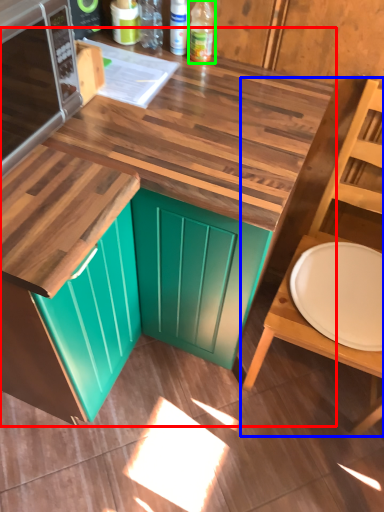
Question: Estimate the real-world distances between objects in this image. Which object is closer to countertop (highlighted by a red box), chair (highlighted by a blue box) or bottle (highlighted by a green box)?

Choices:
 (A) chair
 (B) bottle

Answer: (A)